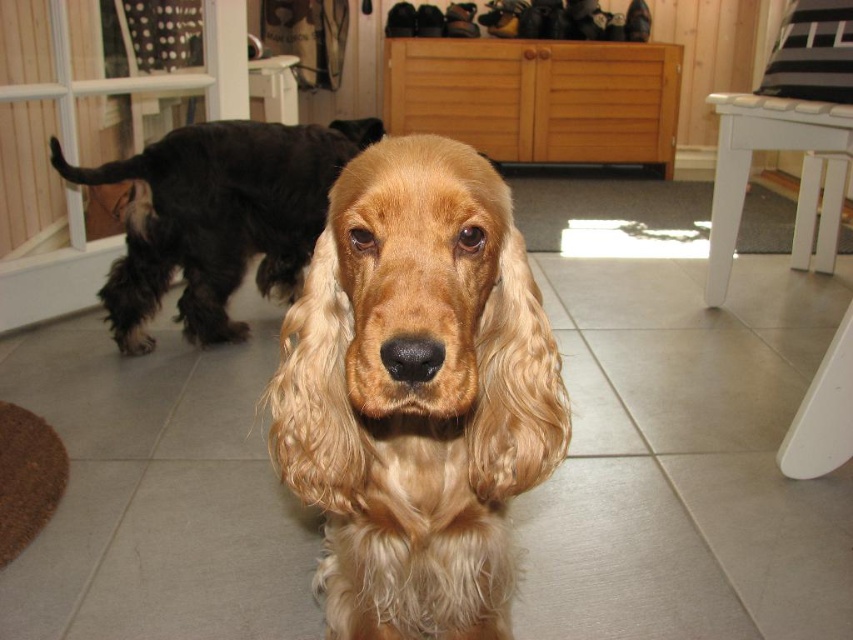
Question: Where is golden fur dog at center located in relation to black fuzzy dog at left in the image?

Choices:
 (A) above
 (B) below

Answer: (B)

Question: Can you confirm if golden fur dog at center is bigger than black fuzzy dog at left?

Choices:
 (A) yes
 (B) no

Answer: (B)

Question: Which of the following is the closest to the observer?

Choices:
 (A) (215, 266)
 (B) (397, 317)

Answer: (B)

Question: Does golden fur dog at center appear over black fuzzy dog at left?

Choices:
 (A) yes
 (B) no

Answer: (B)